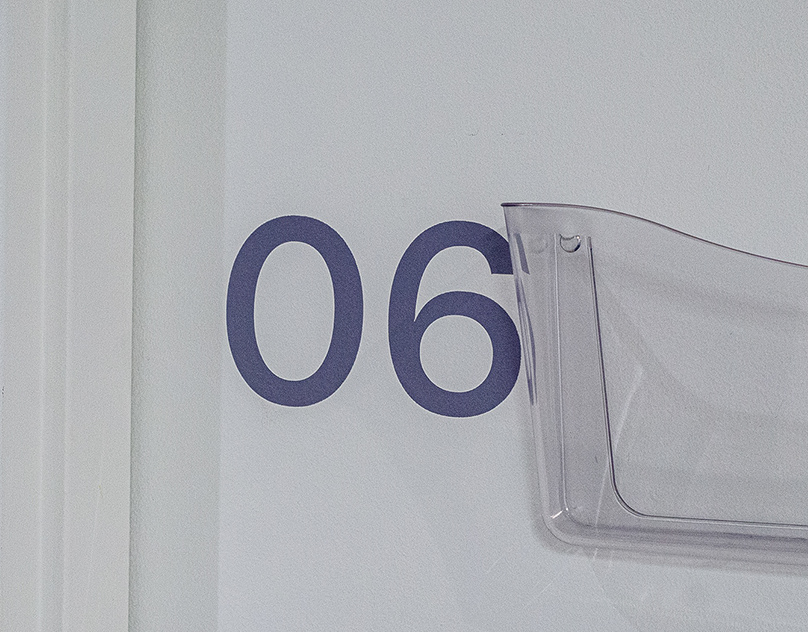
At what (x,y) coordinates should I click in order to perform the action: click on wall. Please return your answer as a coordinate pair (x, y). Looking at the image, I should click on (344, 512).